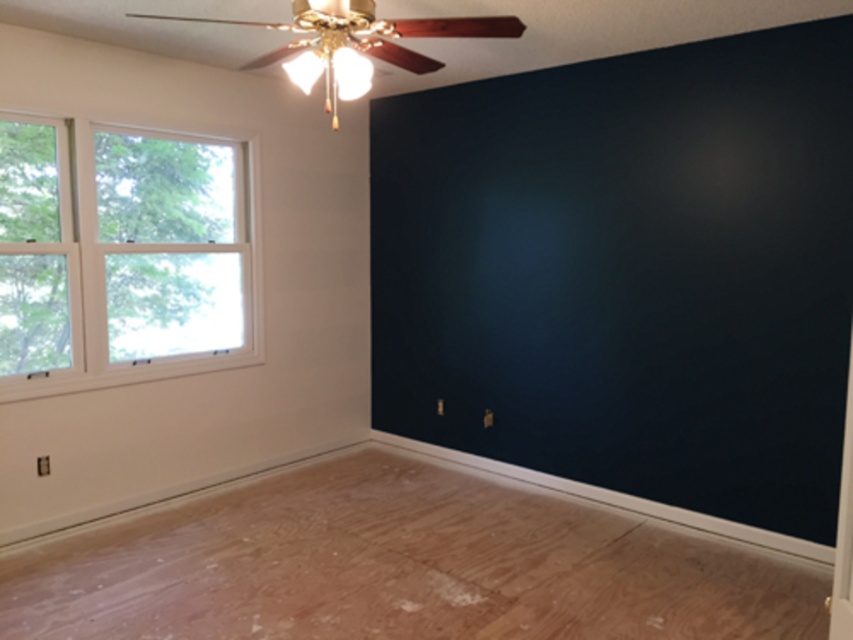
How distant is natural wood floor at lower center from clear glass window at left?

They are 5.05 feet apart.

Is natural wood floor at lower center thinner than clear glass window at left?

Incorrect, natural wood floor at lower center's width is not less than clear glass window at left's.

Measure the distance between point (x=410, y=529) and camera.

A distance of 3.93 meters exists between point (x=410, y=529) and camera.

What are the coordinates of `natural wood floor at lower center` in the screenshot? It's located at (401, 566).